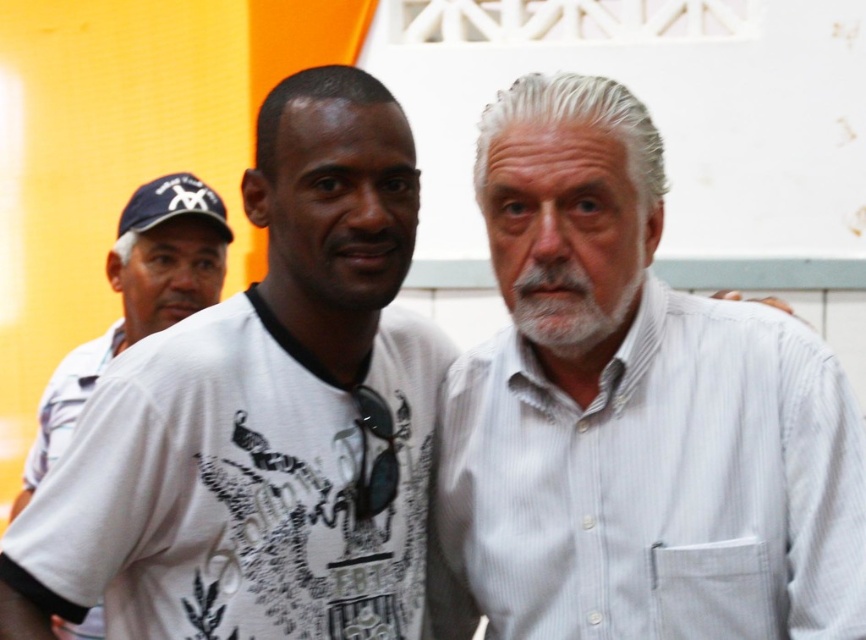
Which is more to the left, white printed t-shirt at center or white cotton shirt at left?

white cotton shirt at left

This screenshot has width=866, height=640. I want to click on white printed t-shirt at center, so click(x=244, y=488).

Where is `white printed t-shirt at center`? The image size is (866, 640). white printed t-shirt at center is located at coordinates (244, 488).

Can you confirm if white striped shirt at center is bigger than matte blue baseball cap at upper left?

Yes.

Can you confirm if white striped shirt at center is positioned below matte blue baseball cap at upper left?

Yes.

Who is more distant from viewer, (574, 422) or (133, 230)?

The point (133, 230) is more distant.

You are a GUI agent. You are given a task and a screenshot of the screen. Output one action in this format:
    pyautogui.click(x=<x>, y=<y>)
    Task: Click on the white striped shirt at center
    
    Given the screenshot: What is the action you would take?
    pyautogui.click(x=654, y=486)

Can you confirm if white cotton shirt at left is smaller than whitehairbeard at center?

Incorrect, white cotton shirt at left is not smaller in size than whitehairbeard at center.

Can you confirm if white cotton shirt at left is thinner than whitehairbeard at center?

In fact, white cotton shirt at left might be wider than whitehairbeard at center.

You are a GUI agent. You are given a task and a screenshot of the screen. Output one action in this format:
    pyautogui.click(x=<x>, y=<y>)
    Task: Click on the white cotton shirt at left
    This screenshot has width=866, height=640.
    Given the screenshot: What is the action you would take?
    pyautogui.click(x=137, y=298)